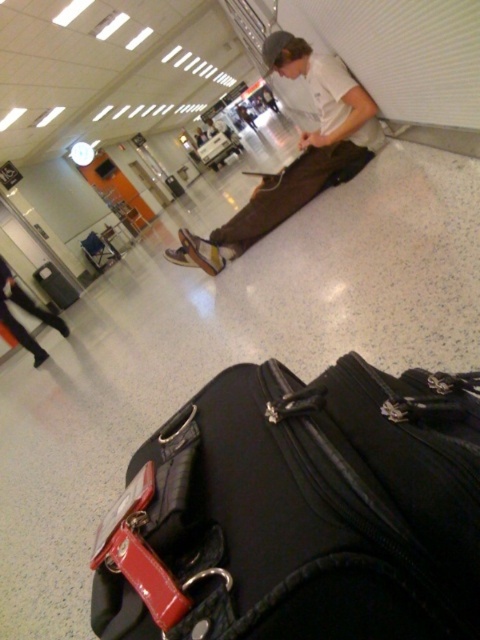
Question: Can you confirm if black fabric suitcase at lower center is positioned below brown canvas pants at center?

Choices:
 (A) no
 (B) yes

Answer: (B)

Question: Does black fabric suitcase at lower center appear on the right side of brown canvas pants at center?

Choices:
 (A) yes
 (B) no

Answer: (B)

Question: Which object appears farthest from the camera in this image?

Choices:
 (A) black fabric suitcase at lower center
 (B) brown canvas pants at center

Answer: (B)

Question: Which of the following is the closest to the observer?

Choices:
 (A) brown canvas pants at center
 (B) black fabric suitcase at lower center

Answer: (B)

Question: Does black fabric suitcase at lower center have a lesser width compared to brown canvas pants at center?

Choices:
 (A) no
 (B) yes

Answer: (B)